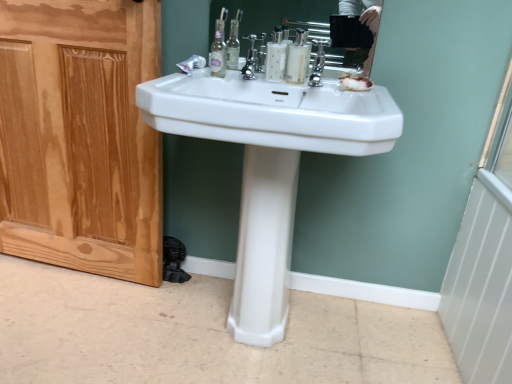
Question: Looking at their shapes, would you say natural wood screen door at left is wider or thinner than white glossy mouthwash at center, which ranks as the 2th mouthwash in left-to-right order?

Choices:
 (A) thin
 (B) wide

Answer: (B)

Question: Is natural wood screen door at left inside the boundaries of white glossy mouthwash at center, acting as the 1th mouthwash starting from the right, or outside?

Choices:
 (A) inside
 (B) outside

Answer: (B)

Question: Estimate the real-world distances between objects in this image. Which object is farther from the white glossy pedestal at center?

Choices:
 (A) white glossy sink at center
 (B) polished chrome faucet at center
 (C) marbled white soap at center
 (D) white glossy mouthwash at center, the 2th mouthwash viewed from the right
 (E) natural wood screen door at left

Answer: (E)

Question: Considering the real-world distances, which object is closest to the white glossy mouthwash at center, the 2th mouthwash viewed from the right?

Choices:
 (A) white glossy sink at center
 (B) natural wood screen door at left
 (C) marbled white soap at center
 (D) white glossy pedestal at center
 (E) polished chrome tap at center

Answer: (E)